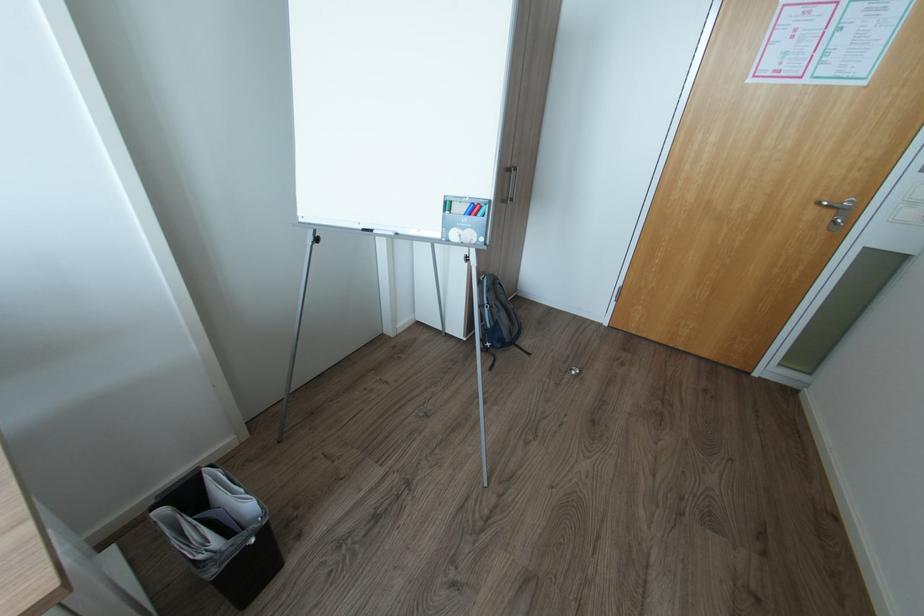
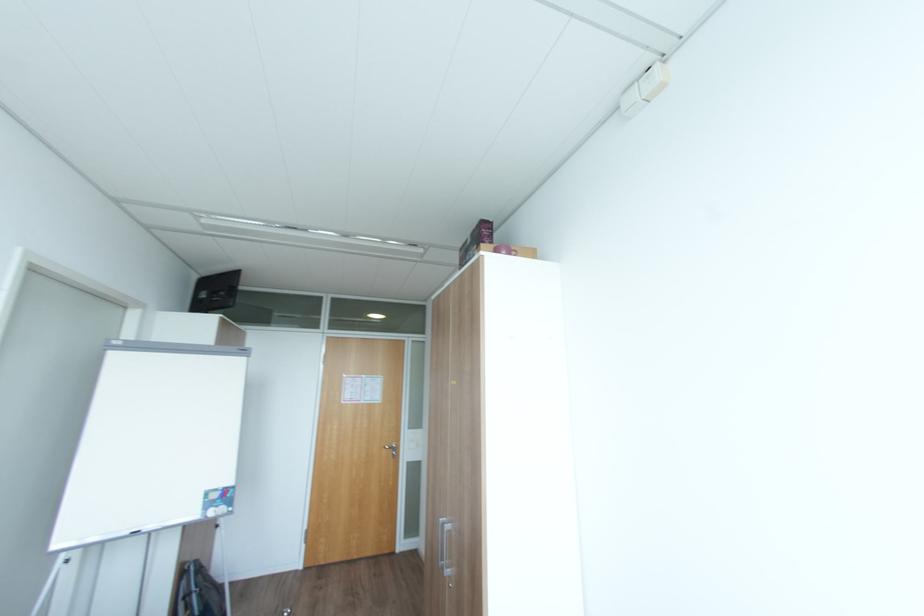
Find the pixel in the second image that matches (x=830, y=204) in the first image.

(392, 448)